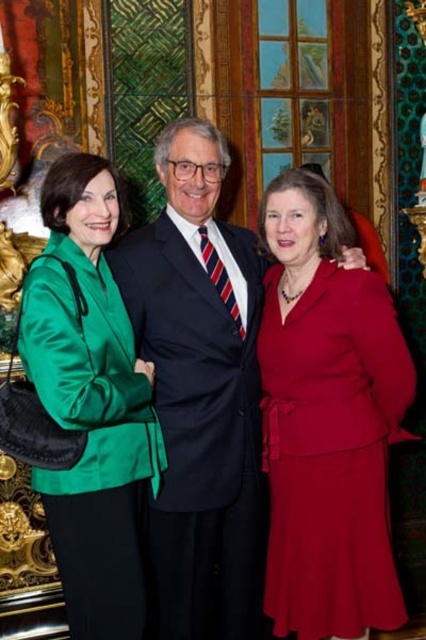
Measure the distance between matte black suit at center and camera.

A distance of 10.80 meters exists between matte black suit at center and camera.

Is point (178, 579) positioned behind point (322, 353)?

No, (178, 579) is in front of (322, 353).

Which is behind, point (261, 557) or point (325, 352)?

The point (261, 557) is behind.

Where is `matte black suit at center`? This screenshot has height=640, width=426. matte black suit at center is located at coordinates (201, 392).

Can you confirm if matte black suit at center is positioned below green satin blazer at left?

Actually, matte black suit at center is above green satin blazer at left.

What do you see at coordinates (201, 392) in the screenshot?
I see `matte black suit at center` at bounding box center [201, 392].

Is point (160, 509) positioned after point (77, 326)?

Yes, point (160, 509) is behind point (77, 326).

The width and height of the screenshot is (426, 640). What are the coordinates of `matte black suit at center` in the screenshot? It's located at (201, 392).

Find the location of a particular element. The height and width of the screenshot is (640, 426). matte red dress at center is located at coordinates (331, 452).